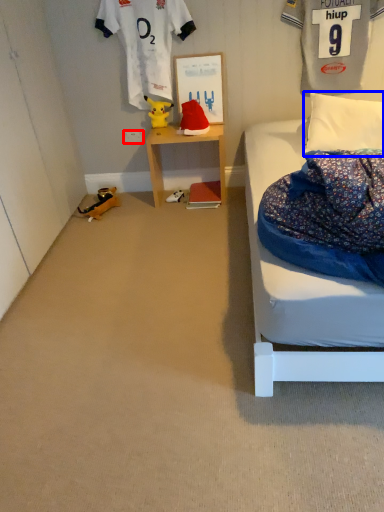
Question: Which of the following is the closest to the observer, power outlet (highlighted by a red box) or pillow (highlighted by a blue box)?

Choices:
 (A) power outlet
 (B) pillow

Answer: (B)